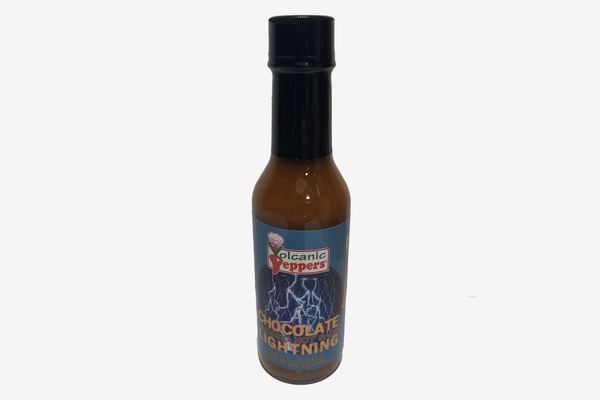
This screenshot has width=600, height=400. I want to click on lighting on bottle, so click(x=300, y=297).